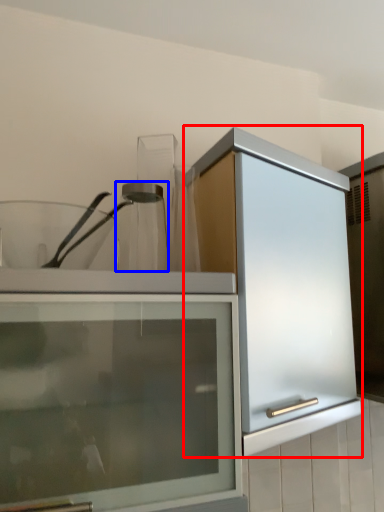
Question: Which object appears farthest to the camera in this image, cabinetry (highlighted by a red box) or glass jar (highlighted by a blue box)?

Choices:
 (A) cabinetry
 (B) glass jar

Answer: (B)